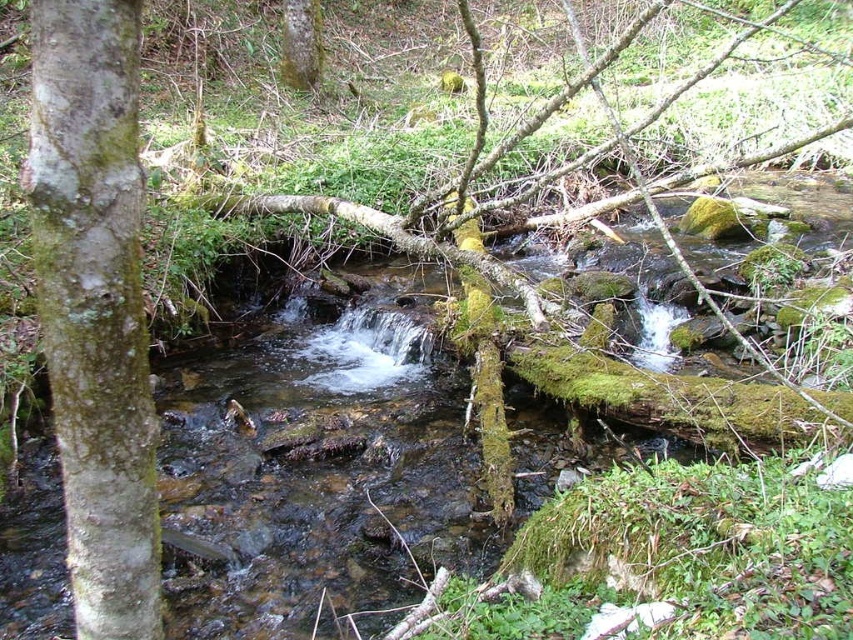
Question: Does green mossy bark at left lie in front of green mossy tree trunk at upper center?

Choices:
 (A) no
 (B) yes

Answer: (B)

Question: Which of the following is the farthest from the observer?

Choices:
 (A) green mossy bark at left
 (B) green mossy tree trunk at upper center

Answer: (B)

Question: Among these objects, which one is farthest from the camera?

Choices:
 (A) green mossy bark at left
 (B) green mossy tree trunk at upper center

Answer: (B)

Question: Does green mossy bark at left have a larger size compared to green mossy tree trunk at upper center?

Choices:
 (A) yes
 (B) no

Answer: (B)

Question: Can you confirm if green mossy bark at left is wider than green mossy tree trunk at upper center?

Choices:
 (A) yes
 (B) no

Answer: (B)